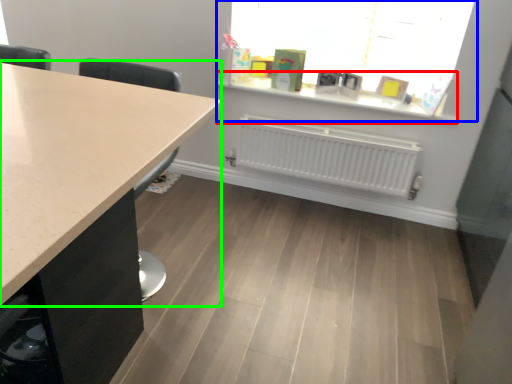
Question: Which object is the farthest from window sill (highlighted by a red box)? Choose among these: window (highlighted by a blue box) or countertop (highlighted by a green box).

Choices:
 (A) window
 (B) countertop

Answer: (B)